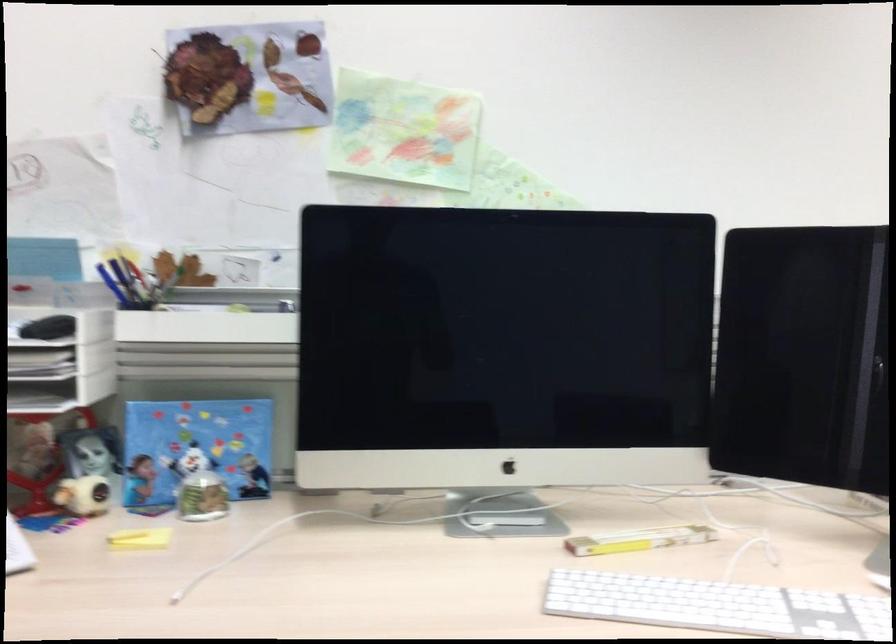
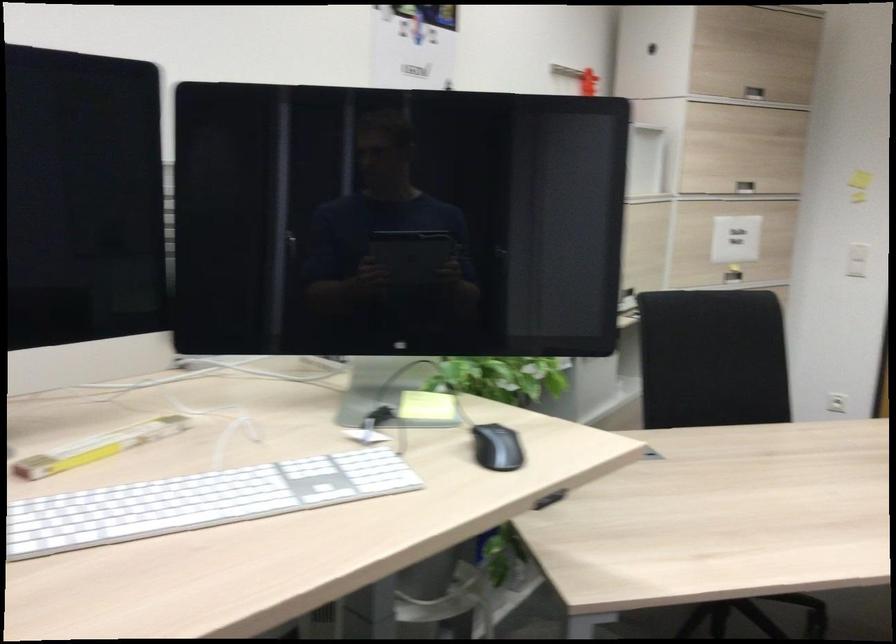
Question: How did the camera likely rotate?

Choices:
 (A) Left
 (B) Right
 (C) Up
 (D) Down

Answer: (B)